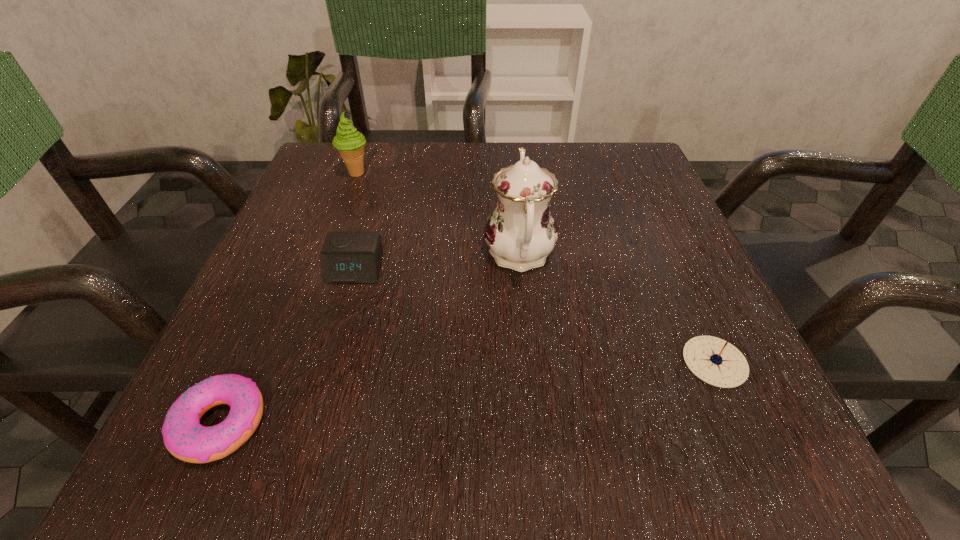
Identify the location of free spot between the chinaware and the rightmost object. (617, 308).

This screenshot has height=540, width=960. Identify the location of empty space between the shortest object and the chinaware. (370, 340).

Image resolution: width=960 pixels, height=540 pixels. Identify the location of empty location between the shortest object and the icecream. (288, 299).

I want to click on vacant space that's between the rightmost object and the second object from right to left, so click(617, 308).

This screenshot has width=960, height=540. Identify the location of free space between the shortest object and the third shortest object. (288, 347).

Locate an element on the screen. object that is the second closest to the rightmost object is located at coordinates (347, 257).

Find the location of a particular element. The width and height of the screenshot is (960, 540). the fourth closest object to the rightmost object is located at coordinates (350, 143).